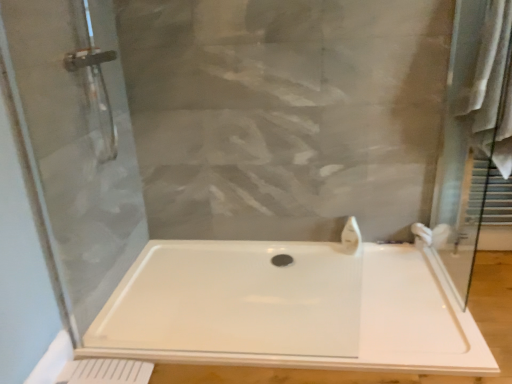
Question: Can you confirm if white glossy faucet at upper right is bigger than white fabric bath towel at right?

Choices:
 (A) yes
 (B) no

Answer: (B)

Question: From the image's perspective, is white glossy faucet at upper right over white fabric bath towel at right?

Choices:
 (A) yes
 (B) no

Answer: (B)

Question: Is white fabric bath towel at right surrounded by white glossy faucet at upper right?

Choices:
 (A) yes
 (B) no

Answer: (B)

Question: Is white glossy faucet at upper right smaller than white fabric bath towel at right?

Choices:
 (A) no
 (B) yes

Answer: (B)

Question: Is white glossy faucet at upper right at the left side of white fabric bath towel at right?

Choices:
 (A) yes
 (B) no

Answer: (A)

Question: Is white glossy faucet at upper right taller or shorter than white plastic bathtub at center?

Choices:
 (A) short
 (B) tall

Answer: (B)

Question: Is white glossy faucet at upper right bigger or smaller than white plastic bathtub at center?

Choices:
 (A) big
 (B) small

Answer: (B)

Question: Looking at their shapes, would you say white glossy faucet at upper right is wider or thinner than white plastic bathtub at center?

Choices:
 (A) thin
 (B) wide

Answer: (A)

Question: Is point (358, 233) closer or farther from the camera than point (152, 337)?

Choices:
 (A) closer
 (B) farther

Answer: (B)

Question: Visually, is white fabric bath towel at right positioned to the left or to the right of white plastic bathtub at center?

Choices:
 (A) left
 (B) right

Answer: (B)

Question: Is point (485, 29) positioned closer to the camera than point (195, 294)?

Choices:
 (A) closer
 (B) farther

Answer: (A)

Question: Considering the positions of white fabric bath towel at right and white plastic bathtub at center in the image, is white fabric bath towel at right bigger or smaller than white plastic bathtub at center?

Choices:
 (A) big
 (B) small

Answer: (A)

Question: In terms of width, does white fabric bath towel at right look wider or thinner when compared to white plastic bathtub at center?

Choices:
 (A) thin
 (B) wide

Answer: (A)

Question: Is white glossy faucet at upper right wider or thinner than white fabric bath towel at right?

Choices:
 (A) thin
 (B) wide

Answer: (A)

Question: Visually, is white glossy faucet at upper right positioned to the left or to the right of white fabric bath towel at right?

Choices:
 (A) left
 (B) right

Answer: (A)